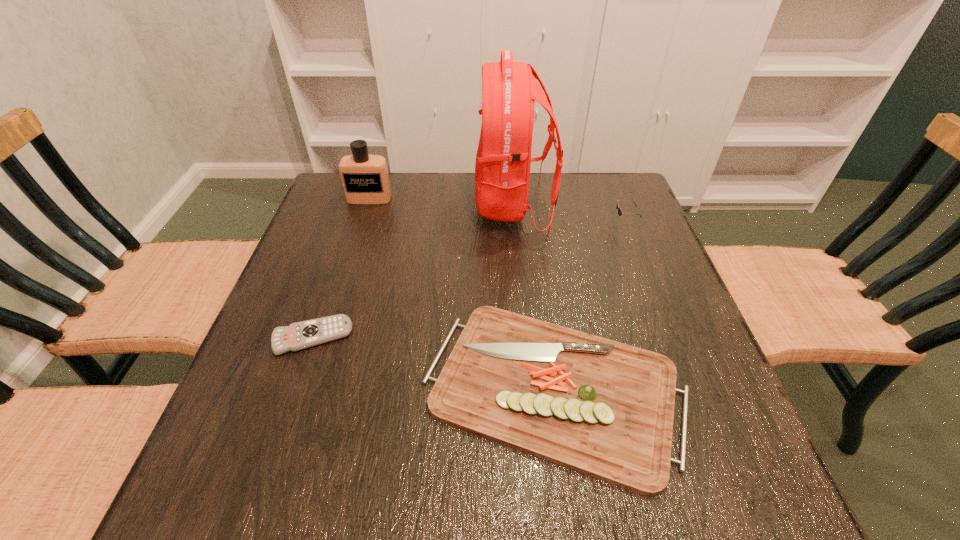
Find the location of a particular element. free spot that satisfies the following two spatial constraints: 1. on the back side of the chopping board; 2. on the main compartment of the tallest object is located at coordinates [529, 206].

This screenshot has height=540, width=960. Find the location of `vacant space that satisfies the following two spatial constraints: 1. on the back side of the second shortest object; 2. on the main compartment of the tallest object`. vacant space that satisfies the following two spatial constraints: 1. on the back side of the second shortest object; 2. on the main compartment of the tallest object is located at coordinates (529, 206).

Identify the location of vacant region that satisfies the following two spatial constraints: 1. on the main compartment of the fourth tallest object; 2. on the left side of the tallest object. The image size is (960, 540). (530, 388).

Find the location of `free region that satisfies the following two spatial constraints: 1. on the front label of the second tallest object; 2. on the left side of the chopping board`. free region that satisfies the following two spatial constraints: 1. on the front label of the second tallest object; 2. on the left side of the chopping board is located at coordinates (309, 388).